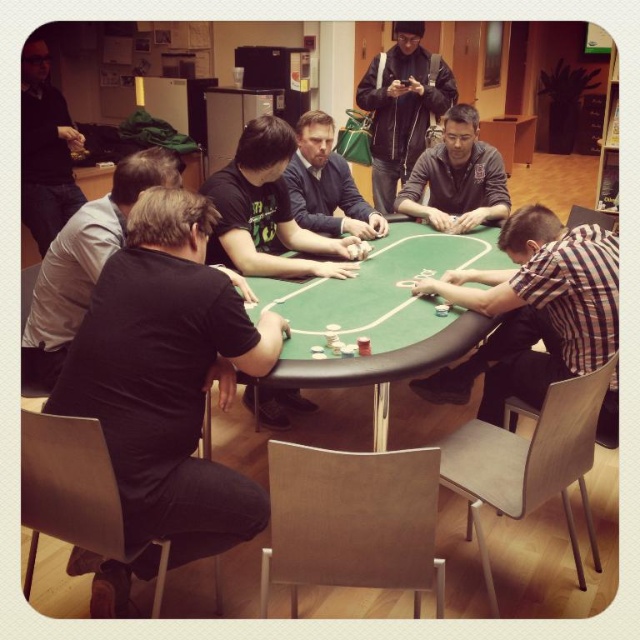
Question: Does black matte shirt at center appear over black matte shirt at lower left?

Choices:
 (A) yes
 (B) no

Answer: (A)

Question: Among these points, which one is farthest from the camera?

Choices:
 (A) (240, 262)
 (B) (36, 326)
 (C) (500, 236)

Answer: (A)

Question: Can you confirm if black matte shirt at lower left is positioned above dark gray shirt at center?

Choices:
 (A) yes
 (B) no

Answer: (B)

Question: Which point appears closest to the camera in this image?

Choices:
 (A) (438, 353)
 (B) (259, 396)
 (C) (104, 198)
 (D) (444, 81)

Answer: (A)

Question: Is black matte shirt at lower left thinner than dark gray shirt at center?

Choices:
 (A) no
 (B) yes

Answer: (A)

Question: Among these objects, which one is nearest to the camera?

Choices:
 (A) black matte shirt at center
 (B) black matte shirt at lower left

Answer: (B)